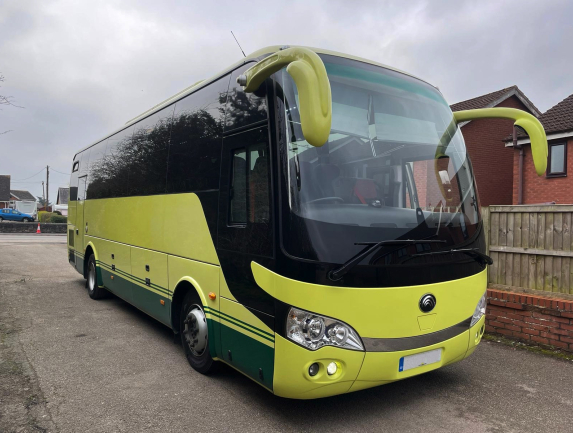
This screenshot has height=433, width=573. I want to click on front window, so click(x=359, y=192), click(x=411, y=154).